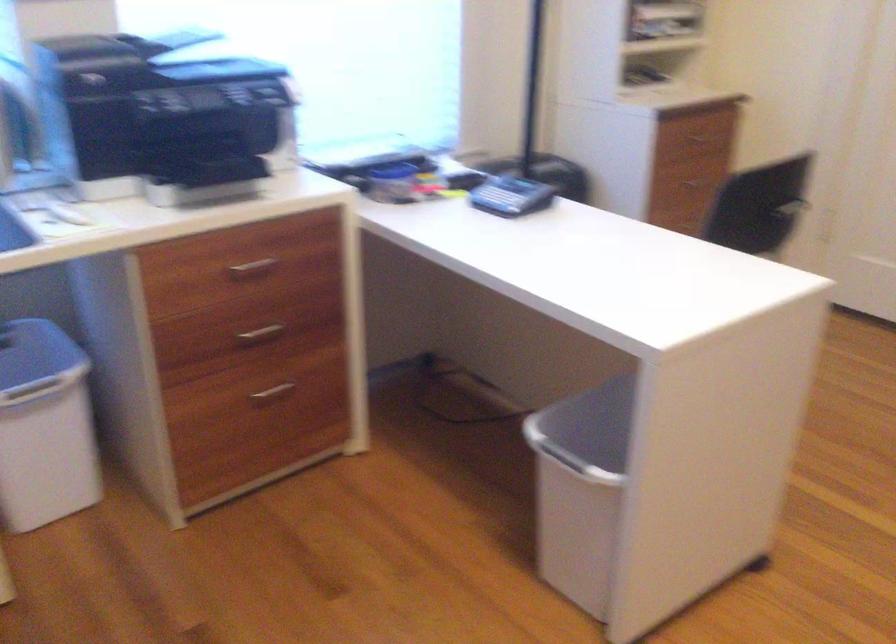
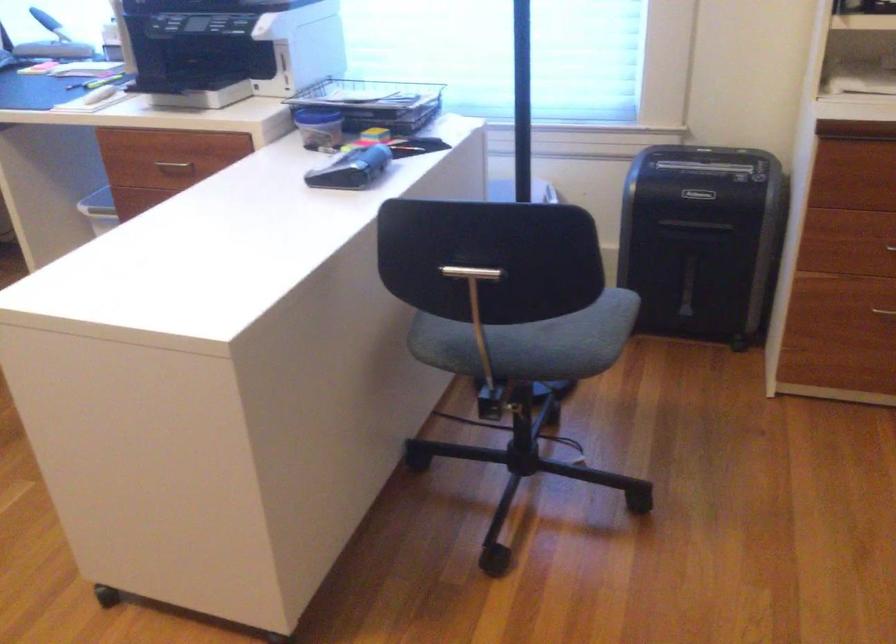
In the second image, find the point that corresponds to (x=752, y=252) in the first image.

(476, 308)